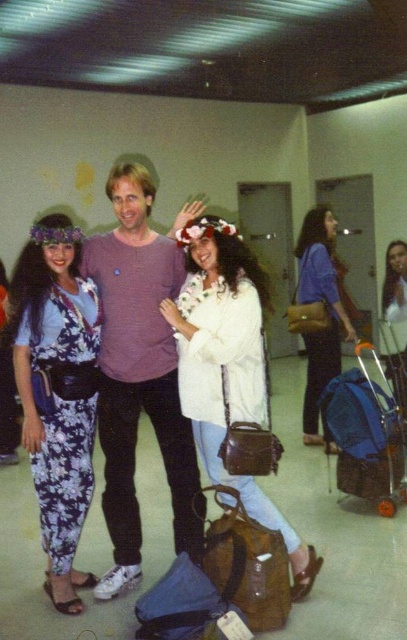
In the image, there are a floral print jumpsuit at left and a matte brown purse at center. Which of these two items is positioned more to the left side of the scene?

The floral print jumpsuit at left is positioned more to the left side of the scene than the matte brown purse at center.

You are a delivery person who needs to place a 20 inch box between the blue fabric suitcase at lower right and the matte brown purse at center. Is there enough space?

The blue fabric suitcase at lower right and matte brown purse at center are 22.61 inches apart. Since the box is 20 inches long, there is enough space to place it between them.

In the scene shown: You are standing in the room and see two points marked on the wall. The first point is at coordinates point (150, 282) and the second point is at point (336, 273). Which point is closer to you?

Point (150, 282) is in front of point (336, 273), so it is closer to you.